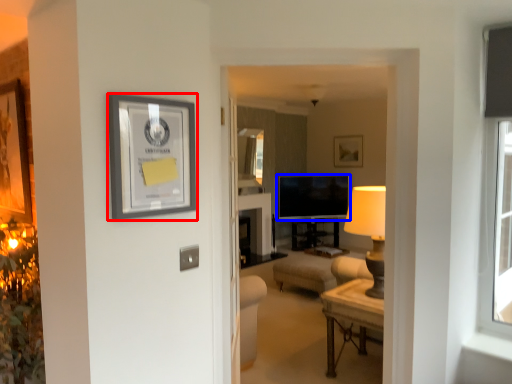
Question: Among these objects, which one is farthest to the camera, picture frame (highlighted by a red box) or television (highlighted by a blue box)?

Choices:
 (A) picture frame
 (B) television

Answer: (B)